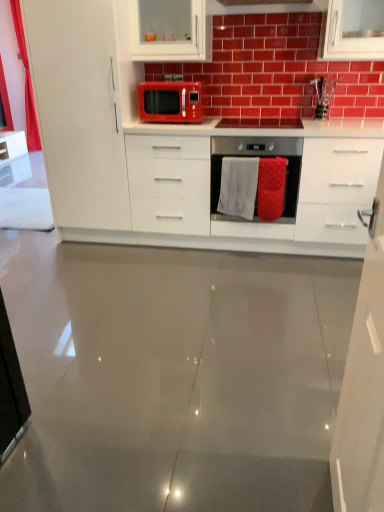
Image resolution: width=384 pixels, height=512 pixels. What do you see at coordinates (271, 188) in the screenshot? I see `red textured towel at center` at bounding box center [271, 188].

Measure the distance between point (x=266, y=183) and camera.

The distance of point (x=266, y=183) from camera is 2.83 meters.

Find the location of a particular element. This screenshot has width=384, height=512. stainless steel oven at center is located at coordinates (259, 157).

At what (x,y) coordinates should I click in order to perform the action: click on white towel at center. Please return your answer as a coordinate pair (x, y). Looking at the image, I should click on [x=238, y=187].

What is the approximate width of white glossy cabinet at left, arranged as the second cabinetry when viewed from the front?

white glossy cabinet at left, arranged as the second cabinetry when viewed from the front, is 25.46 inches wide.

You are a GUI agent. You are given a task and a screenshot of the screen. Output one action in this format:
    pyautogui.click(x=<x>, y=<y>)
    Task: Click on the white glossy countertop at center
    
    Given the screenshot: What is the action you would take?
    pyautogui.click(x=262, y=223)

Find the location of a particular element. red textured towel at center is located at coordinates (271, 188).

Would you say white glossy countertop at center is part of white glossy cabinet at left, positioned as the 1th cabinetry in left-to-right order,'s contents?

No.

Between point (60, 64) and point (323, 128), which one is positioned in front?

Point (60, 64)

Looking at this image, is white glossy cabinet at left, positioned as the 1th cabinetry in left-to-right order, facing towards white glossy countertop at center?

No, white glossy cabinet at left, positioned as the 1th cabinetry in left-to-right order, is not oriented towards white glossy countertop at center.

From the picture: Is white glossy cabinet at left, which is the third cabinetry in right-to-left order, next to white glossy countertop at center and touching it?

There is a gap between white glossy cabinet at left, which is the third cabinetry in right-to-left order, and white glossy countertop at center.

Is stainless steel oven at center touching white glossy countertop at center?

No, stainless steel oven at center is not beside white glossy countertop at center.

Considering the relative sizes of stainless steel oven at center and white glossy countertop at center in the image provided, is stainless steel oven at center taller than white glossy countertop at center?

Incorrect, the height of stainless steel oven at center is not larger of that of white glossy countertop at center.

Considering the sizes of objects stainless steel oven at center and white glossy countertop at center in the image provided, who is thinner, stainless steel oven at center or white glossy countertop at center?

Thinner between the two is stainless steel oven at center.

From the image's perspective, is stainless steel oven at center positioned above or below white glossy countertop at center?

Based on their image positions, stainless steel oven at center is located above white glossy countertop at center.

Considering the sizes of objects red textured towel at center and white glossy cabinet at left, arranged as the second cabinetry when viewed from the front, in the image provided, who is shorter, red textured towel at center or white glossy cabinet at left, arranged as the second cabinetry when viewed from the front,?

red textured towel at center.

Between red textured towel at center and white glossy cabinet at left, which appears as the 2th cabinetry when viewed from the back, which one is positioned behind?

red textured towel at center is behind.

Is red textured towel at center positioned far away from white glossy cabinet at left, which appears as the 2th cabinetry when viewed from the back?

Yes, red textured towel at center is far from white glossy cabinet at left, which appears as the 2th cabinetry when viewed from the back.

Is white towel at center thinner than stainless steel oven at center?

Yes.

Would you say white towel at center is a long distance from stainless steel oven at center?

No, white towel at center is in close proximity to stainless steel oven at center.

Is white towel at center surrounding stainless steel oven at center?

No, stainless steel oven at center is located outside of white towel at center.

Considering the sizes of white towel at center and stainless steel oven at center in the image, is white towel at center bigger or smaller than stainless steel oven at center?

In the image, white towel at center appears to be smaller than stainless steel oven at center.

From a real-world perspective, is white glossy cabinet at upper center, which appears as the second cabinetry when viewed from the right, below white glossy countertop at center?

No, from a real-world perspective, white glossy cabinet at upper center, which appears as the second cabinetry when viewed from the right, is not under white glossy countertop at center.

Based on the photo, is white glossy cabinet at upper center, which ranks as the 1th cabinetry in back-to-front order, oriented away from white glossy countertop at center?

No, white glossy cabinet at upper center, which ranks as the 1th cabinetry in back-to-front order,'s orientation is not away from white glossy countertop at center.

Is white glossy cabinet at upper center, which appears as the second cabinetry when viewed from the right, to the right of white glossy countertop at center from the viewer's perspective?

No, white glossy cabinet at upper center, which appears as the second cabinetry when viewed from the right, is not to the right of white glossy countertop at center.

From a real-world perspective, is matte red microwave at center physically above white glossy cabinet at upper right, which is the first cabinetry from front to back?

Correct, in the physical world, matte red microwave at center is higher than white glossy cabinet at upper right, which is the first cabinetry from front to back.

Which is more to the left, matte red microwave at center or white glossy cabinet at upper right, the 1th cabinetry when ordered from right to left?

matte red microwave at center.

Is matte red microwave at center taller than white glossy cabinet at upper right, the 1th cabinetry when ordered from right to left?

Incorrect, the height of matte red microwave at center is not larger of that of white glossy cabinet at upper right, the 1th cabinetry when ordered from right to left.

Is matte red microwave at center smaller than white glossy cabinet at upper right, which is the first cabinetry from front to back?

Indeed, matte red microwave at center has a smaller size compared to white glossy cabinet at upper right, which is the first cabinetry from front to back.

How different are the orientations of stainless steel oven at center and white glossy cabinet at upper right, which is the first cabinetry from front to back, in degrees?

The facing directions of stainless steel oven at center and white glossy cabinet at upper right, which is the first cabinetry from front to back, are 92.5 degrees apart.

Can you confirm if stainless steel oven at center is taller than white glossy cabinet at upper right, the 1th cabinetry when ordered from right to left?

Incorrect, the height of stainless steel oven at center is not larger of that of white glossy cabinet at upper right, the 1th cabinetry when ordered from right to left.

Visually, is stainless steel oven at center positioned to the left or to the right of white glossy cabinet at upper right, positioned as the third cabinetry in left-to-right order?

stainless steel oven at center is positioned on white glossy cabinet at upper right, positioned as the third cabinetry in left-to-right order,'s right side.

Is stainless steel oven at center inside or outside of white glossy cabinet at upper right, placed as the 3th cabinetry when sorted from back to front?

stainless steel oven at center is not enclosed by white glossy cabinet at upper right, placed as the 3th cabinetry when sorted from back to front.

This screenshot has width=384, height=512. I want to click on countertop below the white glossy cabinet at left, which appears as the 2th cabinetry when viewed from the back (from the image's perspective), so click(262, 223).

Identify the location of countertop in front of the stainless steel oven at center. (262, 223).

Based on their spatial positions, is white glossy cabinet at upper center, which appears as the second cabinetry when viewed from the right, or red textured towel at center closer to white glossy cabinet at upper right, positioned as the third cabinetry in left-to-right order?

red textured towel at center lies closer to white glossy cabinet at upper right, positioned as the third cabinetry in left-to-right order, than the other object.

Based on their spatial positions, is white glossy cabinet at left, arranged as the second cabinetry when viewed from the front, or matte red microwave at center further from white towel at center?

white glossy cabinet at left, arranged as the second cabinetry when viewed from the front, is positioned further to the anchor white towel at center.

Looking at the image, which one is located further to stainless steel oven at center, white glossy countertop at center or white glossy cabinet at left, arranged as the second cabinetry when viewed from the front?

white glossy cabinet at left, arranged as the second cabinetry when viewed from the front, is positioned further to the anchor stainless steel oven at center.

When comparing their distances from matte red microwave at center, does white glossy cabinet at upper center, which appears as the second cabinetry when viewed from the right, or white towel at center seem closer?

white glossy cabinet at upper center, which appears as the second cabinetry when viewed from the right, lies closer to matte red microwave at center than the other object.

Estimate the real-world distances between objects in this image. Which object is closer to white glossy cabinet at upper center, which appears as the second cabinetry when viewed from the right, red textured towel at center or white towel at center?

Among the two, white towel at center is located nearer to white glossy cabinet at upper center, which appears as the second cabinetry when viewed from the right.

From the image, which object appears to be farther from white glossy cabinet at upper right, placed as the 3th cabinetry when sorted from back to front, matte red microwave at center or white towel at center?

matte red microwave at center is further to white glossy cabinet at upper right, placed as the 3th cabinetry when sorted from back to front.

Estimate the real-world distances between objects in this image. Which object is closer to white glossy countertop at center, white glossy cabinet at upper right, the 1th cabinetry when ordered from right to left, or white glossy cabinet at left, positioned as the 1th cabinetry in left-to-right order?

white glossy cabinet at left, positioned as the 1th cabinetry in left-to-right order.

In the scene shown: Which object lies nearer to the anchor point stainless steel oven at center, matte red microwave at center or white glossy countertop at center?

white glossy countertop at center lies closer to stainless steel oven at center than the other object.

Locate an element on the screen. countertop positioned between white glossy cabinet at upper right, positioned as the third cabinetry in left-to-right order, and white glossy cabinet at upper center, acting as the 3th cabinetry starting from the front, from near to far is located at coordinates (262, 223).

Where is `kitchen appliance located between white glossy cabinet at left, which appears as the 2th cabinetry when viewed from the back, and red textured towel at center in the left-right direction`? This screenshot has height=512, width=384. kitchen appliance located between white glossy cabinet at left, which appears as the 2th cabinetry when viewed from the back, and red textured towel at center in the left-right direction is located at coordinates (170, 101).

What are the coordinates of `countertop between matte red microwave at center and red textured towel at center from top to bottom` in the screenshot? It's located at (262, 223).

The width and height of the screenshot is (384, 512). I want to click on cabinetry located between white glossy cabinet at upper right, positioned as the third cabinetry in left-to-right order, and white glossy cabinet at upper center, which appears as the second cabinetry when viewed from the right, in the depth direction, so click(x=78, y=110).